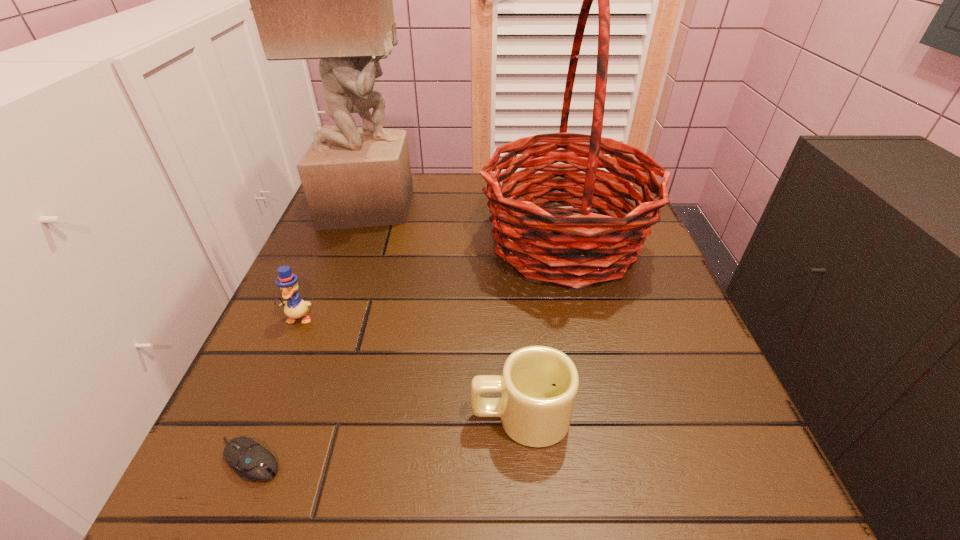
At what (x,y) coordinates should I click in order to perform the action: click on object that is at the near left corner. Please return your answer as a coordinate pair (x, y). This screenshot has height=540, width=960. Looking at the image, I should click on (251, 461).

Image resolution: width=960 pixels, height=540 pixels. Identify the location of object that is at the far right corner. pyautogui.click(x=572, y=254).

Where is `free point at the near edge`? free point at the near edge is located at coordinates pyautogui.click(x=374, y=492).

This screenshot has width=960, height=540. In the image, there is a desktop. Find the location of `free space at the left edge`. free space at the left edge is located at coordinates (330, 258).

Identify the location of free space at the right edge. This screenshot has height=540, width=960. (663, 367).

Where is `free spot between the computer mouse and the sculpture`? free spot between the computer mouse and the sculpture is located at coordinates (310, 333).

This screenshot has width=960, height=540. In order to click on free space between the third farthest object and the sculpture in this screenshot , I will do `click(334, 262)`.

What are the coordinates of `free area in between the basket and the computer mouse` in the screenshot? It's located at (407, 351).

I want to click on free area in between the mug and the shortest object, so click(385, 438).

You are a GUI agent. You are given a task and a screenshot of the screen. Output one action in this format:
    pyautogui.click(x=<x>, y=<y>)
    Task: Click on the free space between the shortest object and the basket
    
    Given the screenshot: What is the action you would take?
    pyautogui.click(x=407, y=351)